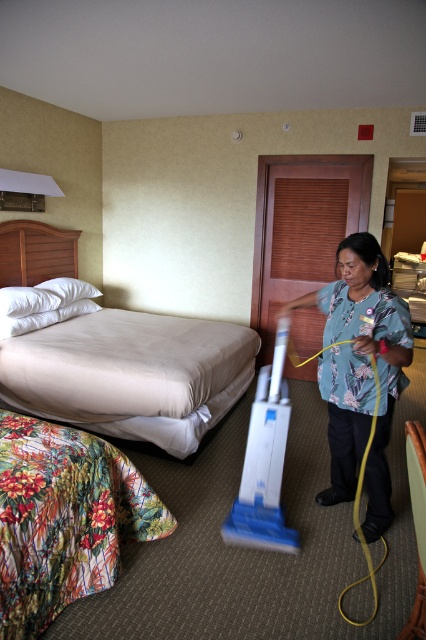
Question: Which point appears farthest from the camera in this image?

Choices:
 (A) (348, 436)
 (B) (195, 337)

Answer: (B)

Question: Is beige fabric bed at left positioned before floral print shirt at center?

Choices:
 (A) no
 (B) yes

Answer: (A)

Question: From the image, what is the correct spatial relationship of beige fabric bed at left in relation to floral print shirt at center?

Choices:
 (A) below
 (B) above

Answer: (B)

Question: Among these objects, which one is farthest from the camera?

Choices:
 (A) floral print shirt at center
 (B) beige fabric bed at left

Answer: (B)

Question: Can you confirm if beige fabric bed at left is smaller than floral print shirt at center?

Choices:
 (A) no
 (B) yes

Answer: (A)